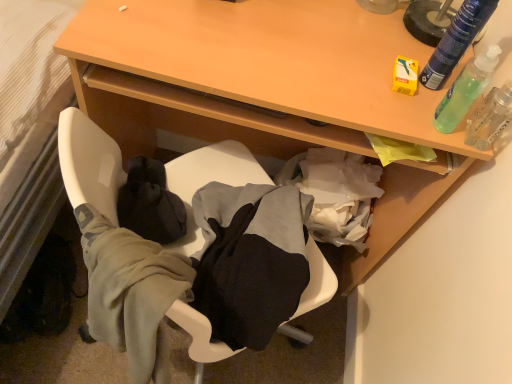
The width and height of the screenshot is (512, 384). Identify the location of free space to the back side of green translucent bottle at upper right, the 2th bottle in the top-to-bottom sequence. (419, 62).